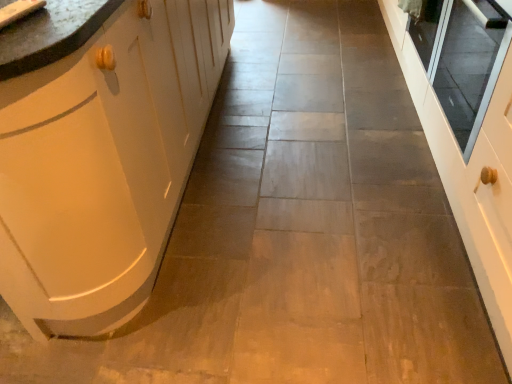
Question: From the image's perspective, does matte white sink at upper left appear lower than transparent glass door at right?

Choices:
 (A) no
 (B) yes

Answer: (B)

Question: Considering the relative sizes of matte white sink at upper left and transparent glass door at right in the image provided, is matte white sink at upper left wider than transparent glass door at right?

Choices:
 (A) no
 (B) yes

Answer: (A)

Question: Can you confirm if matte white sink at upper left is shorter than transparent glass door at right?

Choices:
 (A) yes
 (B) no

Answer: (A)

Question: Are matte white sink at upper left and transparent glass door at right beside each other?

Choices:
 (A) no
 (B) yes

Answer: (A)

Question: Is matte white sink at upper left to the right of transparent glass door at right from the viewer's perspective?

Choices:
 (A) yes
 (B) no

Answer: (B)

Question: From a real-world perspective, is matte white sink at upper left positioned under transparent glass door at right based on gravity?

Choices:
 (A) yes
 (B) no

Answer: (B)

Question: Is transparent glass door at right positioned far away from matte white sink at upper left?

Choices:
 (A) yes
 (B) no

Answer: (A)

Question: Does transparent glass door at right touch matte white sink at upper left?

Choices:
 (A) no
 (B) yes

Answer: (A)

Question: Is transparent glass door at right at the right side of matte white sink at upper left?

Choices:
 (A) yes
 (B) no

Answer: (A)

Question: Would you say transparent glass door at right is outside matte white sink at upper left?

Choices:
 (A) no
 (B) yes

Answer: (B)

Question: From the image's perspective, is transparent glass door at right under matte white sink at upper left?

Choices:
 (A) yes
 (B) no

Answer: (B)

Question: Is transparent glass door at right oriented away from matte white sink at upper left?

Choices:
 (A) yes
 (B) no

Answer: (B)

Question: Is matte white sink at upper left to the left of matte white cabinet at left from the viewer's perspective?

Choices:
 (A) no
 (B) yes

Answer: (A)